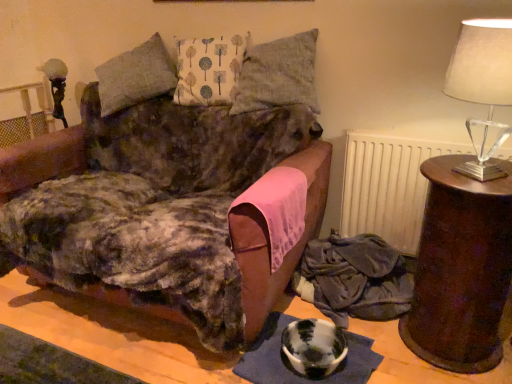
Question: From a real-world perspective, does white matte radiator at upper right stand above velvet brown couch at center?

Choices:
 (A) yes
 (B) no

Answer: (B)

Question: Is white matte radiator at upper right not close to velvet brown couch at center?

Choices:
 (A) yes
 (B) no

Answer: (B)

Question: From a real-world perspective, does white matte radiator at upper right sit lower than velvet brown couch at center?

Choices:
 (A) no
 (B) yes

Answer: (B)

Question: Does white matte radiator at upper right lie behind velvet brown couch at center?

Choices:
 (A) yes
 (B) no

Answer: (A)

Question: Is white matte radiator at upper right facing away from velvet brown couch at center?

Choices:
 (A) yes
 (B) no

Answer: (B)

Question: Is white matte radiator at upper right in contact with velvet brown couch at center?

Choices:
 (A) no
 (B) yes

Answer: (A)

Question: Is velvet fabric blanket at lower right located outside brown wooden side table at right?

Choices:
 (A) yes
 (B) no

Answer: (A)

Question: Considering the relative positions of velvet fabric blanket at lower right and brown wooden side table at right in the image provided, is velvet fabric blanket at lower right to the left of brown wooden side table at right from the viewer's perspective?

Choices:
 (A) yes
 (B) no

Answer: (A)

Question: Can you confirm if velvet fabric blanket at lower right is wider than brown wooden side table at right?

Choices:
 (A) no
 (B) yes

Answer: (A)

Question: Is velvet fabric blanket at lower right smaller than brown wooden side table at right?

Choices:
 (A) yes
 (B) no

Answer: (A)

Question: Would you say brown wooden side table at right is part of velvet fabric blanket at lower right's contents?

Choices:
 (A) yes
 (B) no

Answer: (B)

Question: From a real-world perspective, does velvet fabric blanket at lower right stand above brown wooden side table at right?

Choices:
 (A) yes
 (B) no

Answer: (B)

Question: From the image's perspective, is velvet fabric blanket at lower right beneath velvet brown couch at center?

Choices:
 (A) yes
 (B) no

Answer: (A)